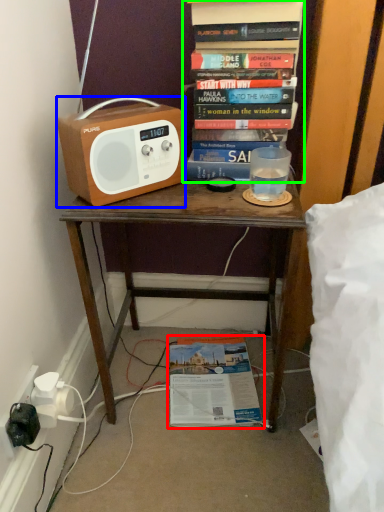
Question: Which is nearer to the book (highlighted by a red box)? cassette (highlighted by a blue box) or book (highlighted by a green box).

Choices:
 (A) cassette
 (B) book

Answer: (A)